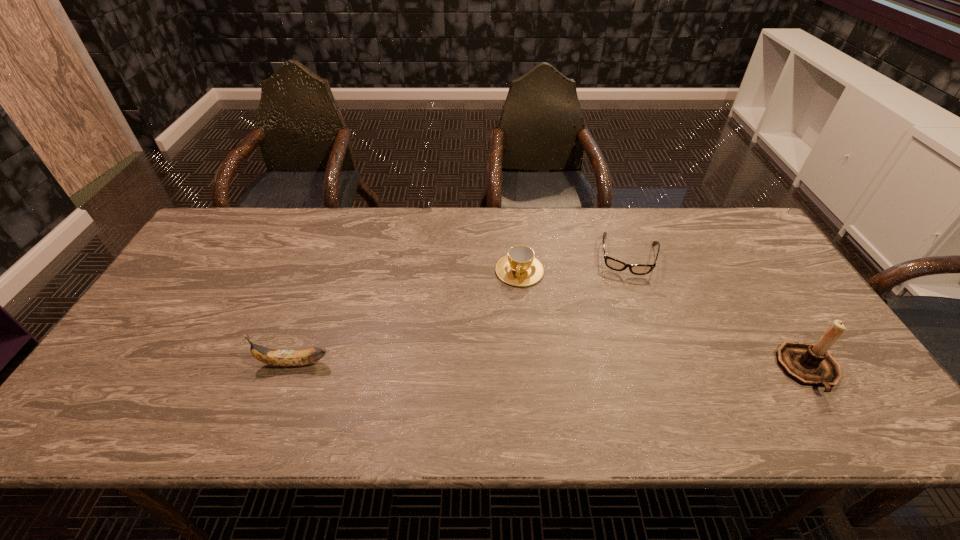
At what (x,y) coordinates should I click in order to perform the action: click on vacant space located on the peel of the second tallest object. Please return your answer as a coordinate pair (x, y). The width and height of the screenshot is (960, 540). Looking at the image, I should click on (112, 363).

Where is `vacant space situated on the back of the tallest object`? Image resolution: width=960 pixels, height=540 pixels. vacant space situated on the back of the tallest object is located at coordinates (767, 304).

At what (x,y) coordinates should I click in order to perform the action: click on vacant space situated on the front-facing side of the second object from right to left. Please return your answer as a coordinate pair (x, y). Looking at the image, I should click on (615, 386).

The image size is (960, 540). In order to click on free region located 0.310m on the front-facing side of the second object from right to left in this screenshot , I will do `click(618, 362)`.

Locate an element on the screen. Image resolution: width=960 pixels, height=540 pixels. free space located on the front-facing side of the second object from right to left is located at coordinates (619, 349).

Identify the location of vacant area located with the handle on the side of the second shortest object. This screenshot has width=960, height=540. pyautogui.click(x=512, y=305).

Where is `vacant space situated with the handle on the side of the second shortest object`? vacant space situated with the handle on the side of the second shortest object is located at coordinates (507, 330).

Where is `free space located with the handle on the side of the second shortest object`? free space located with the handle on the side of the second shortest object is located at coordinates (505, 339).

Identify the location of object located in the far edge section of the desktop. The height and width of the screenshot is (540, 960). (637, 269).

Locate an element on the screen. Image resolution: width=960 pixels, height=540 pixels. banana at the near edge is located at coordinates (285, 358).